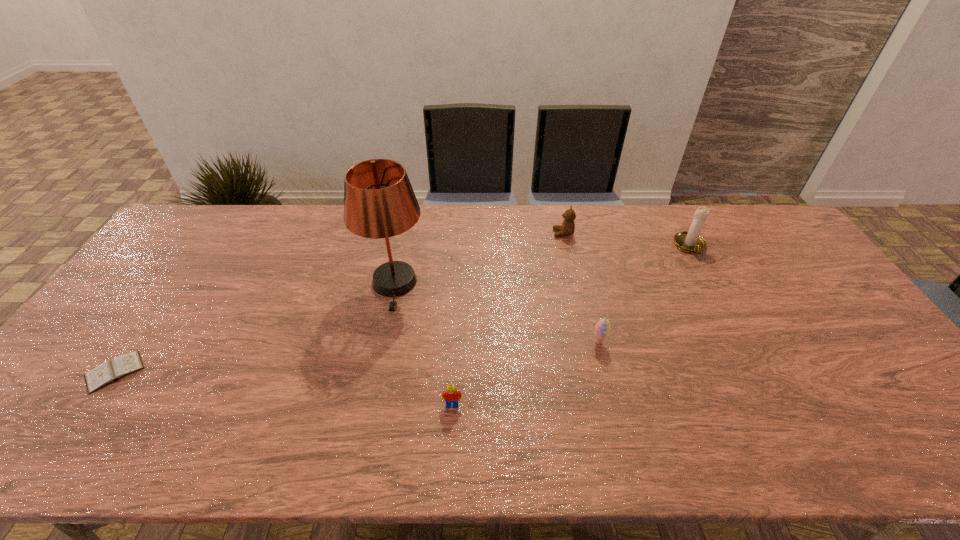
Locate an element on the screen. The width and height of the screenshot is (960, 540). vacant space located on the front-facing side of the lampshade is located at coordinates (362, 448).

In order to click on free region located 0.260m on the handle side of the rightmost object in this screenshot , I will do `click(729, 320)`.

You are a GUI agent. You are given a task and a screenshot of the screen. Output one action in this format:
    pyautogui.click(x=<x>, y=<y>)
    Task: Click on the vacant space located on the front-facing side of the teddy bear
    
    Given the screenshot: What is the action you would take?
    click(x=457, y=233)

Identify the location of vacant space located on the front-facing side of the teddy bear. (503, 233).

I want to click on free space located 0.180m on the front-facing side of the teddy bear, so click(500, 233).

Identify the location of free space located on the front of the sherbert. Image resolution: width=960 pixels, height=540 pixels. (605, 370).

The width and height of the screenshot is (960, 540). In order to click on blank area located on the face of the nearest object in this screenshot , I will do `click(450, 455)`.

Where is `vacant space located 0.310m on the back of the shortest object`? The image size is (960, 540). vacant space located 0.310m on the back of the shortest object is located at coordinates (186, 270).

Identify the location of candle holder situated at the far edge. (690, 241).

The width and height of the screenshot is (960, 540). Identify the location of teddy bear that is at the far edge. (567, 228).